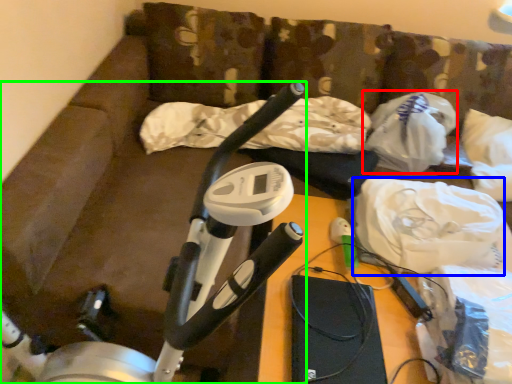
Question: Which object is positioned closest to plastic bag (highlighted by a red box)? Select from material (highlighted by a blue box) and stationary bicycle (highlighted by a green box).

Choices:
 (A) material
 (B) stationary bicycle

Answer: (A)